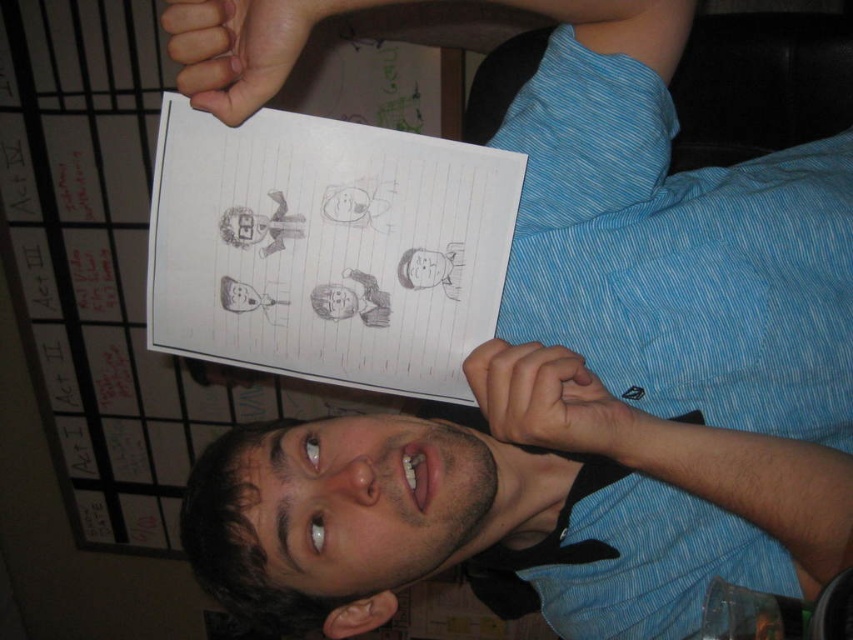
You are a photographer trying to capture the best angle of the person holding the paper. You notice two points on the paper at coordinates point (x=389, y=433) and point (x=421, y=508). Which point is closer to the camera?

Point (x=389, y=433) is further to the camera than point (x=421, y=508), so the point closer to the camera is point (x=421, y=508).

You are an artist trying to sketch the scene. You notice the matte blue shirt at center and the white lined paper at upper center. Which object is located to the right of the other?

The matte blue shirt at center is positioned on the right side of white lined paper at upper center, so the matte blue shirt at center is to the right of the white lined paper at upper center.

You are a photographer trying to capture a clear shot of the dark brown hair at center. However, the white lined paper at upper center is blocking your view. Can you adjust your angle to avoid the paper while still focusing on the hair?

The white lined paper at upper center is positioned over the dark brown hair at center, so adjusting the angle downward slightly would allow you to focus on the dark brown hair at center without the paper blocking the view.